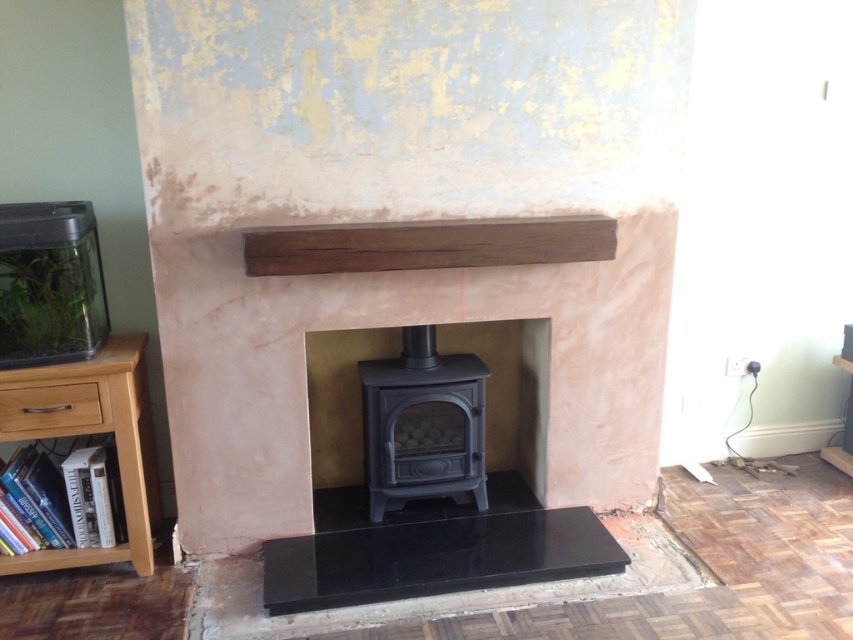
You are standing in front of the fireplace area and want to place a decorative item exactly at the center of the matte black stove at center. According to the coordinates provided, where should you position the item?

The 2D location of the matte black stove at center is at point (509, 388), so you should position the decorative item at those coordinates.

You are standing in the fireplace area and want to place a small decoration. You have two points marked on the wall where you can place it. The points are labeled as point 1 at coordinates point (538, 348) and point 2 at coordinates point (77, 429). Which point is closer to you so that the decoration is more visible?

Point (538, 348) is further to the viewer than point (77, 429), so placing the decoration at point (538, 348) will make it more visible as it is closer to you.